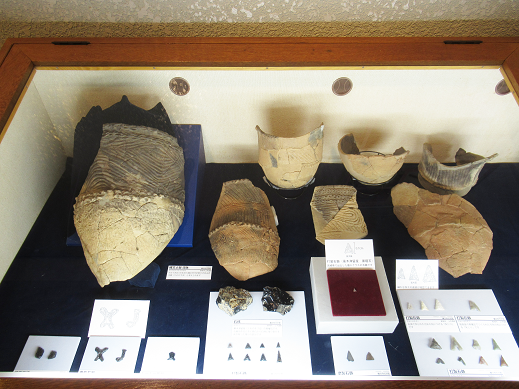
The height and width of the screenshot is (389, 519). What are the coordinates of `reflections on top of case glass` in the screenshot? It's located at (54, 130), (71, 102).